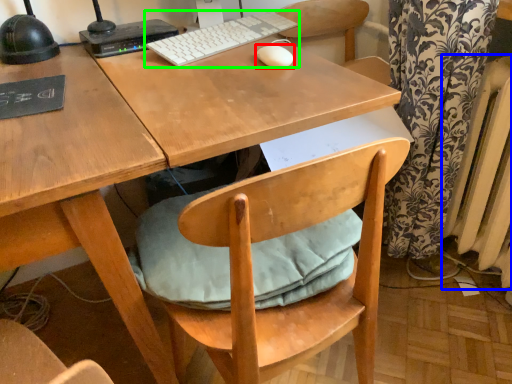
Question: Considering the real-world distances, which object is closest to mouse (highlighted by a red box)? radiator (highlighted by a blue box) or computer keyboard (highlighted by a green box).

Choices:
 (A) radiator
 (B) computer keyboard

Answer: (B)